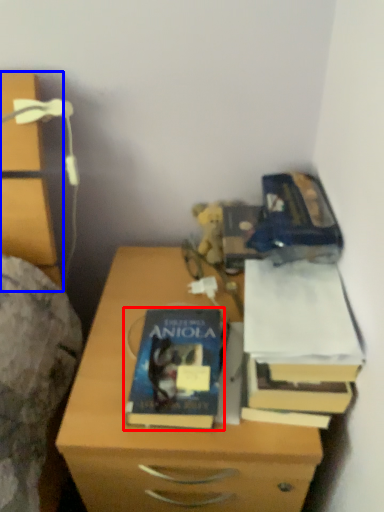
Question: Which point is further to the camera, book (highlighted by a red box) or chest of drawers (highlighted by a blue box)?

Choices:
 (A) book
 (B) chest of drawers

Answer: (A)